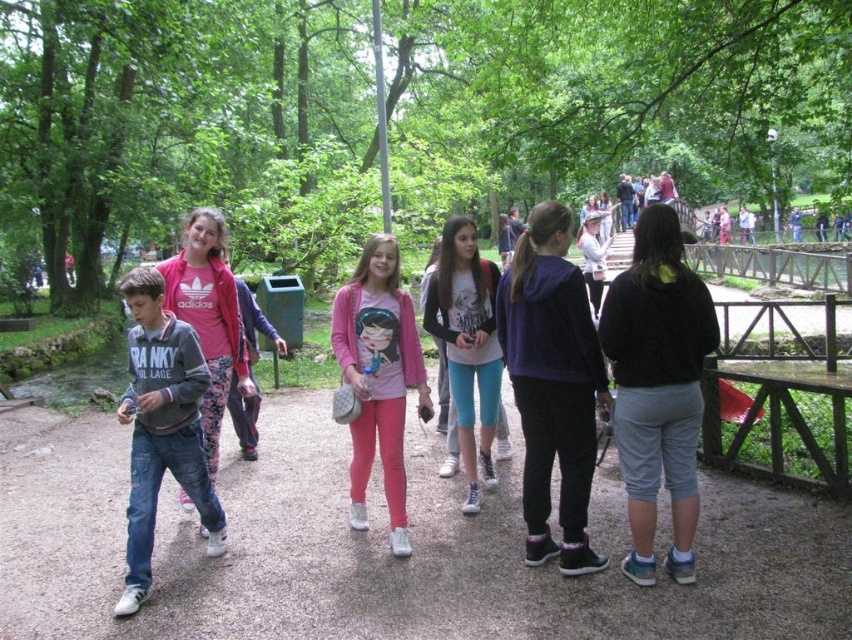
You are standing on the dirt path in the park and see two points marked on the ground. One is at coordinate point (573, 282) and the other at point (404, 344). Which point is closer to your current position?

The point at coordinate (573, 282) is closer to your current position because it is closer to the camera compared to point (404, 344).

You are a photographer positioned on the dirt path. You want to capture a photo that includes both the pink leggings at center and denim jeans at left. Based on their positions, which object should you focus on first to ensure both are in frame?

The pink leggings at center is located below denim jeans at left, so you should focus on the denim jeans at left first to ensure both are in frame.